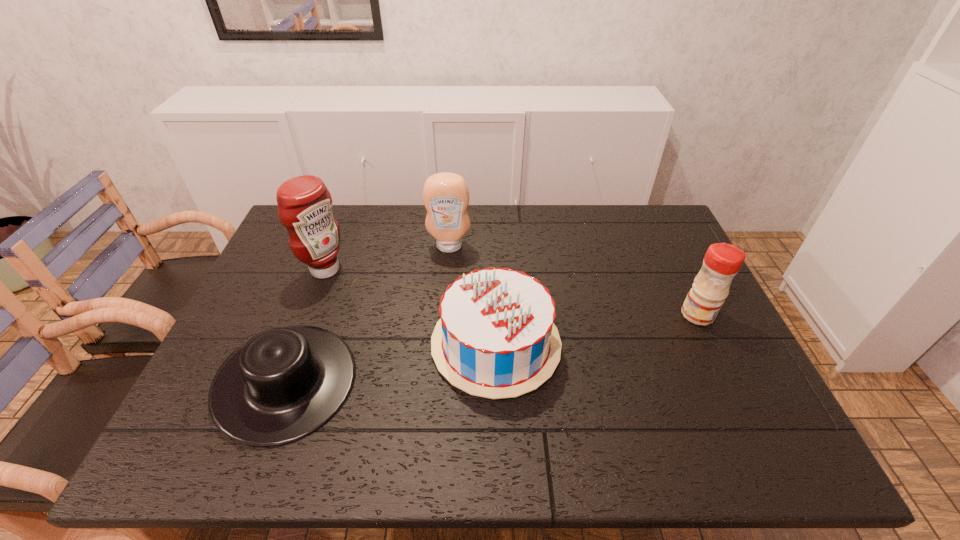
In the image, there is a desktop. Find the location of `vacant space at the near edge`. vacant space at the near edge is located at coordinates (377, 428).

This screenshot has height=540, width=960. In the image, there is a desktop. Identify the location of vacant space at the left edge. (232, 326).

Locate an element on the screen. This screenshot has height=540, width=960. blank space at the right edge is located at coordinates (654, 271).

This screenshot has width=960, height=540. Identify the location of vacant space at the far right corner. (660, 218).

You are a GUI agent. You are given a task and a screenshot of the screen. Output one action in this format:
    pyautogui.click(x=<x>, y=<y>)
    Task: Click on the vacant region between the birthday cake and the dress hat
    This screenshot has height=540, width=960.
    Given the screenshot: What is the action you would take?
    pyautogui.click(x=391, y=363)

Find the location of a particular element. vacant space in between the nearest condiment and the farthest object is located at coordinates (573, 280).

You are a GUI agent. You are given a task and a screenshot of the screen. Output one action in this format:
    pyautogui.click(x=<x>, y=<y>)
    Task: Click on the blank region between the fourth tallest object and the second nearest condiment
    
    Given the screenshot: What is the action you would take?
    pyautogui.click(x=411, y=307)

I want to click on empty location between the nearest condiment and the birthday cake, so click(597, 329).

Locate an element on the screen. The width and height of the screenshot is (960, 540). free spot between the birthday cake and the shortest object is located at coordinates (391, 363).

Image resolution: width=960 pixels, height=540 pixels. What are the coordinates of `the third closest object to the rightmost object` in the screenshot? It's located at (285, 383).